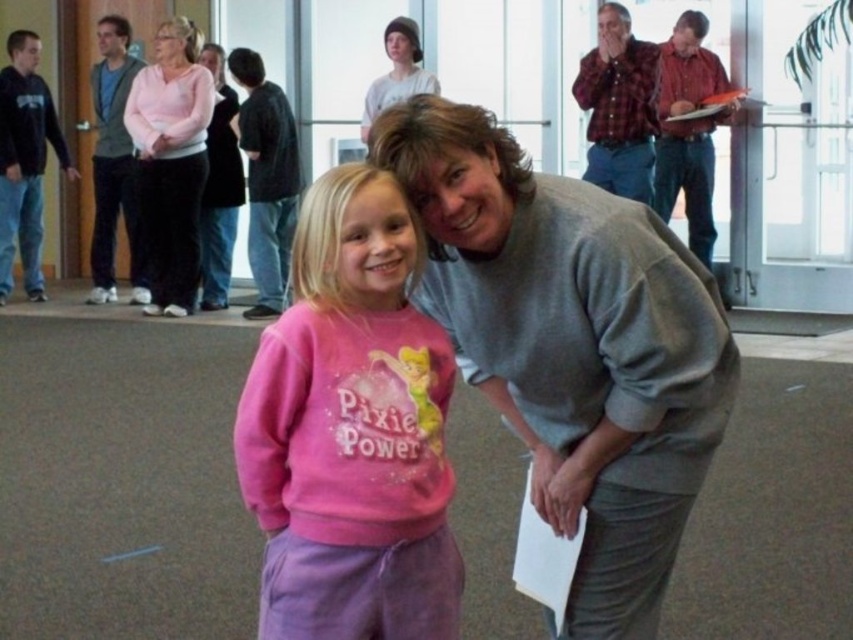
Question: Among these objects, which one is nearest to the camera?

Choices:
 (A) plaid shirt at upper right
 (B) matte pink sweater at upper left

Answer: (B)

Question: Can you confirm if gray sweater at center is positioned above dark blue hoodie at left?

Choices:
 (A) yes
 (B) no

Answer: (B)

Question: Which point is farther to the camera?

Choices:
 (A) gray sweater at center
 (B) pink sweater at upper left
 (C) gray sweater at upper center
 (D) plaid flannel shirt at upper right

Answer: (B)

Question: Is plaid shirt at upper right smaller than gray sweater at upper center?

Choices:
 (A) yes
 (B) no

Answer: (B)

Question: Can you confirm if dark blue hoodie at left is wider than gray sweater at upper center?

Choices:
 (A) no
 (B) yes

Answer: (B)

Question: Which of the following is the closest to the observer?

Choices:
 (A) (401, 602)
 (B) (672, 435)

Answer: (A)